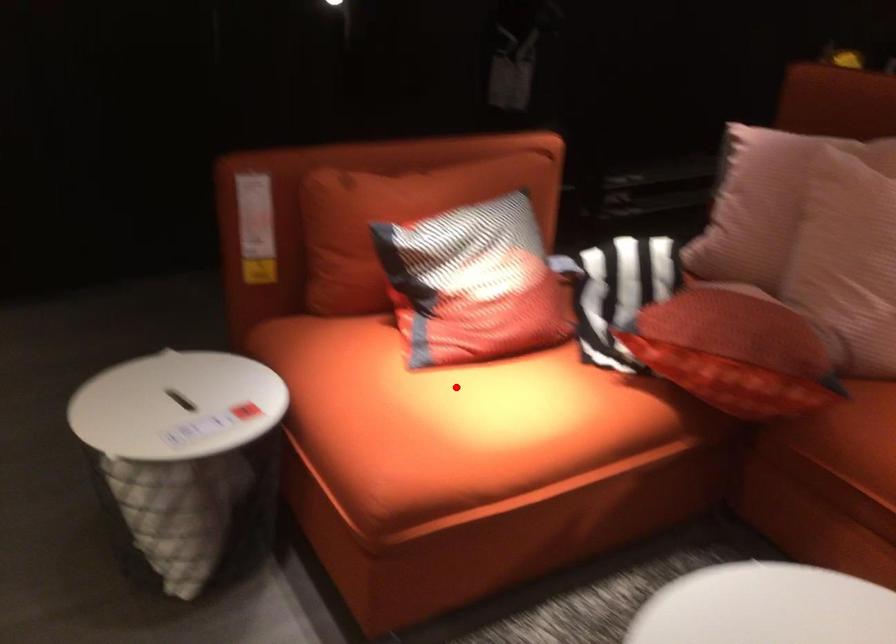
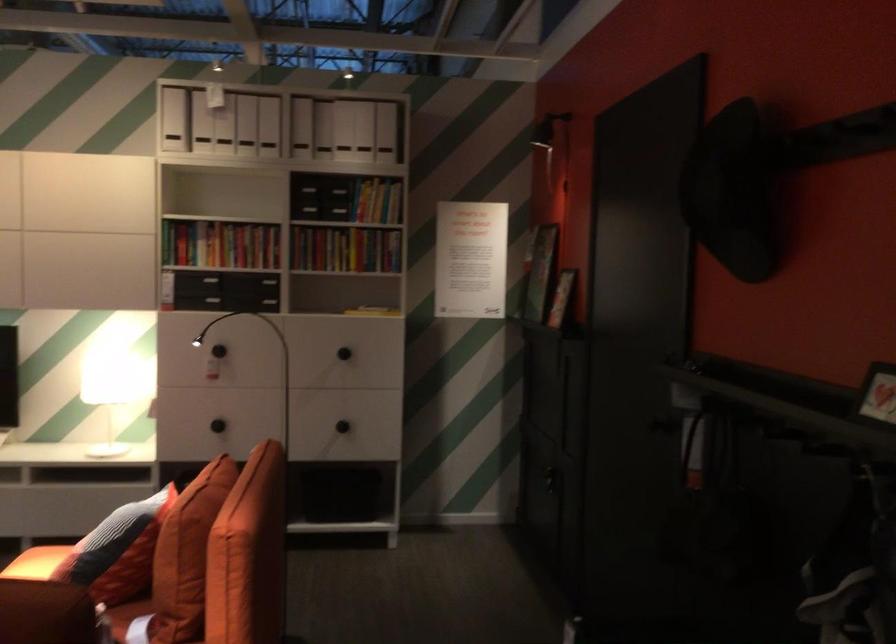
The point at the highlighted location is marked in the first image. Where is the corresponding point in the second image?

(36, 563)